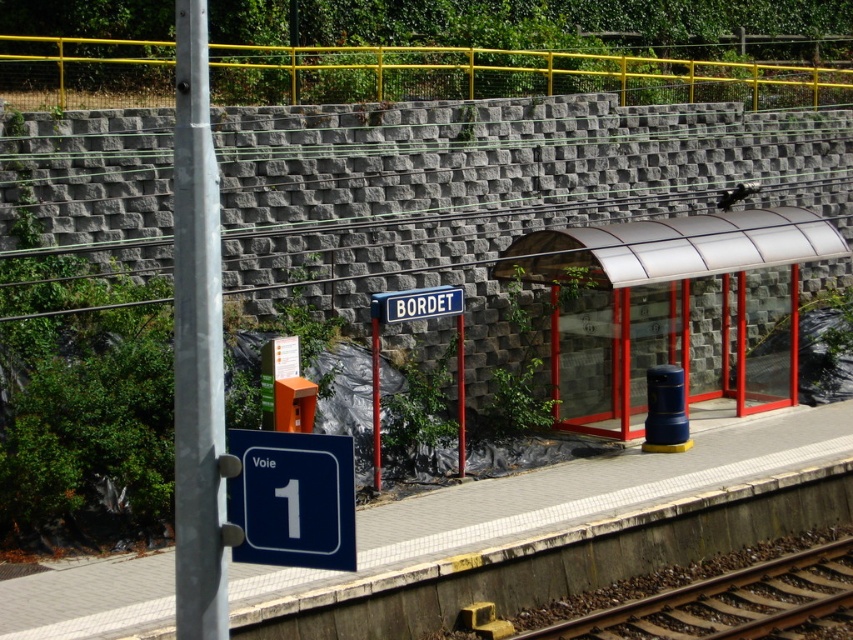
You are a passenger waiting at the station and want to find the blue plastic sign at lower left. From your current position at the transparent plastic bus stop at center, which direction should you walk to locate it?

The blue plastic sign at lower left is positioned to the left of the transparent plastic bus stop at center, so you should walk to your left to locate it.

You are standing on the platform at the railway station. You notice two points marked on the ground. The first point is at coordinate point (590, 406) and the second is at point (328, 568). If you are facing the direction of the tracks, which point is closer to the edge of the platform?

Point (590, 406) is behind point (328, 568). Since you are facing the tracks, the edge of the platform is in front of you. Therefore, point (328, 568) is closer to the edge of the platform.

Based on the photo, you are standing at the point labeled point [564,497] on the platform. Based on the scene description, what type of surface are you standing on?

The point [564,497] corresponds to the smooth concrete platform at center, so you are standing on a smooth concrete surface.